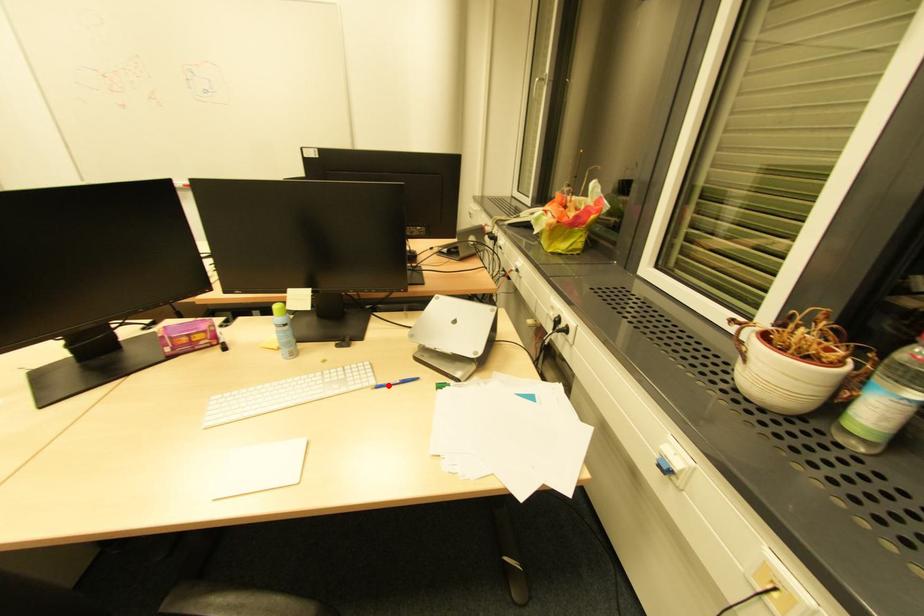
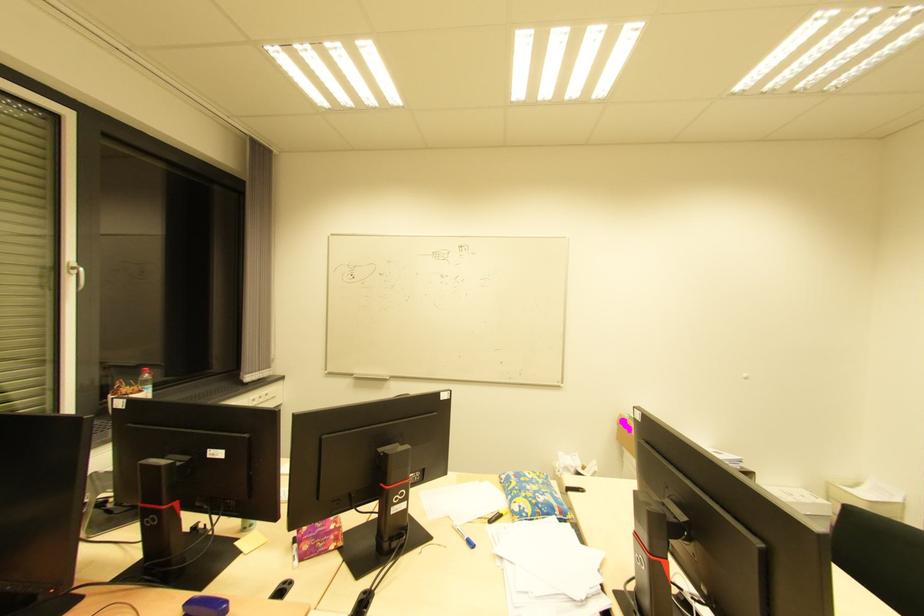
Question: I am providing you with two images of the same scene from different viewpoints. A red point is marked on the first image. At the location where the point appears in image 1, is it still visible in image 2?

Choices:
 (A) Yes
 (B) No

Answer: (B)